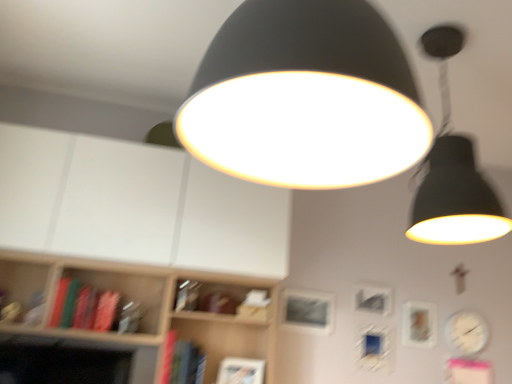
Question: Is white glossy clock at lower right at the back of matte black lampshade at upper right, arranged as the first lamp when viewed from the right?

Choices:
 (A) yes
 (B) no

Answer: (B)

Question: Does matte black lampshade at upper right, arranged as the first lamp when viewed from the back, turn towards white glossy clock at lower right?

Choices:
 (A) no
 (B) yes

Answer: (A)

Question: Can you confirm if matte black lampshade at upper right, arranged as the first lamp when viewed from the back, is positioned to the left of white glossy clock at lower right?

Choices:
 (A) no
 (B) yes

Answer: (B)

Question: Is matte black lampshade at upper right, acting as the second lamp starting from the left, taller than white glossy clock at lower right?

Choices:
 (A) yes
 (B) no

Answer: (A)

Question: From the image's perspective, is matte black lampshade at upper right, acting as the second lamp starting from the left, located beneath white glossy clock at lower right?

Choices:
 (A) yes
 (B) no

Answer: (B)

Question: Does matte black lampshade at upper right, acting as the second lamp starting from the left, have a smaller size compared to white glossy clock at lower right?

Choices:
 (A) yes
 (B) no

Answer: (B)

Question: Is matte black lampshade at center, the 2th lamp viewed from the right, facing away from white glossy clock at lower right?

Choices:
 (A) yes
 (B) no

Answer: (B)

Question: From the image's perspective, does matte black lampshade at center, which is the 1th lamp in front-to-back order, appear higher than white glossy clock at lower right?

Choices:
 (A) no
 (B) yes

Answer: (B)

Question: Could you tell me if matte black lampshade at center, which is the 2th lamp in back-to-front order, is facing white glossy clock at lower right?

Choices:
 (A) no
 (B) yes

Answer: (A)

Question: Considering the relative sizes of matte black lampshade at center, which is the 1th lamp in front-to-back order, and white glossy clock at lower right in the image provided, is matte black lampshade at center, which is the 1th lamp in front-to-back order, bigger than white glossy clock at lower right?

Choices:
 (A) no
 (B) yes

Answer: (B)

Question: Can you confirm if matte black lampshade at center, which is the 2th lamp in back-to-front order, is smaller than white glossy clock at lower right?

Choices:
 (A) no
 (B) yes

Answer: (A)

Question: From the image's perspective, is matte black lampshade at center, the 2th lamp viewed from the right, under white glossy clock at lower right?

Choices:
 (A) yes
 (B) no

Answer: (B)

Question: Is matte silver picture frame at right, which is the third picture frame from left to right, not near metallic silver picture frame at center, arranged as the 1th picture frame when viewed from the left?

Choices:
 (A) no
 (B) yes

Answer: (A)